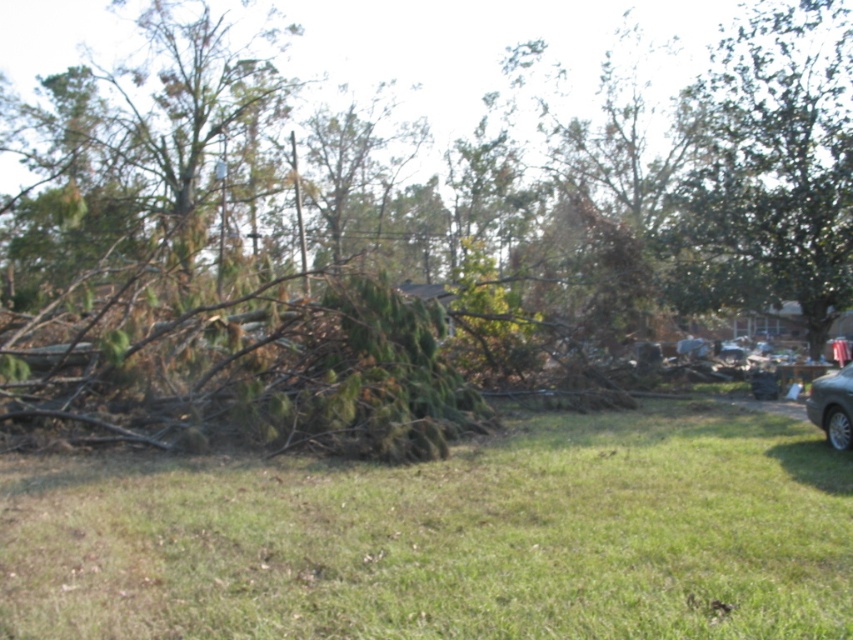
You are a delivery driver who needs to drive your silver metallic car at lower right through the debris field. The green leafy tree at upper right is blocking your path. Can you drive around it to the left?

The green leafy tree at upper right is positioned on the right side of the silver metallic car at lower right, so you can drive around it to the left to avoid the tree.

From the picture: You are a rescue worker assessing the damage from a recent storm. You notice the brown wood debris at center and the green leafy tree at upper right. How far apart are these two objects?

The brown wood debris at center is 15.94 meters away from the green leafy tree at upper right.

You are a delivery driver trying to navigate through the disaster area. You see a green leafy tree at upper right and a silver metallic car at lower right. Which object is closer to you as you approach the scene?

The silver metallic car at lower right is behind the green leafy tree at upper right, so the green leafy tree at upper right is closer to you.